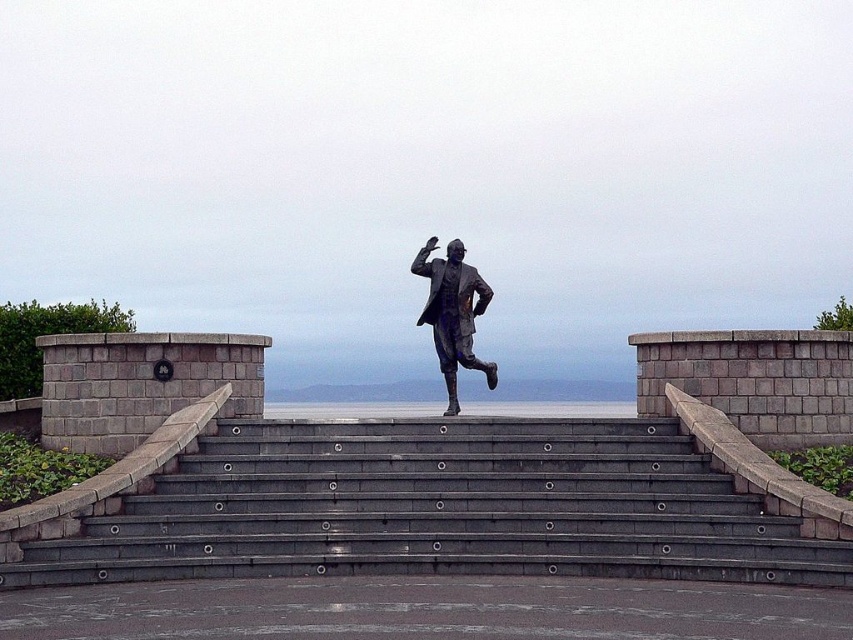
You are standing at the bottom of the gray concrete stairs at center and want to reach the bronze statue at center. Which direction should you move to get closer to the statue?

The bronze statue at center is located above the gray concrete stairs at center, so you should move upward along the gray concrete stairs at center to get closer to the bronze statue at center.

You are standing at the base of the statue and want to climb the steps to take a closer look. According to the coordinates provided, where exactly are the gray concrete stairs at center located in the image?

The gray concrete stairs at center are located at point coordinates of (440, 508).

From the picture: You are a tour guide explaining the layout of the monument to a group. You mention the bronze statue at center and the gray concrete stairs at center. How far apart are these two elements?

The bronze statue at center and the gray concrete stairs at center are 15.90 feet apart.